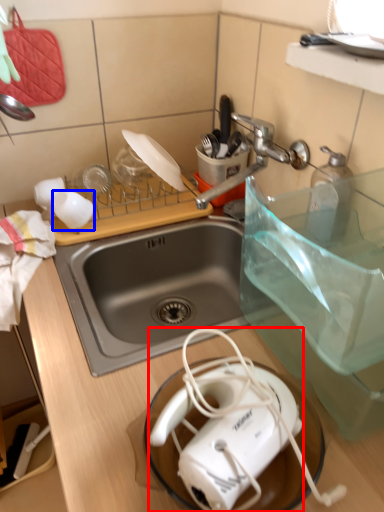
Question: Which object is further to the camera taking this photo, toaster (highlighted by a red box) or coffee cup (highlighted by a blue box)?

Choices:
 (A) toaster
 (B) coffee cup

Answer: (B)